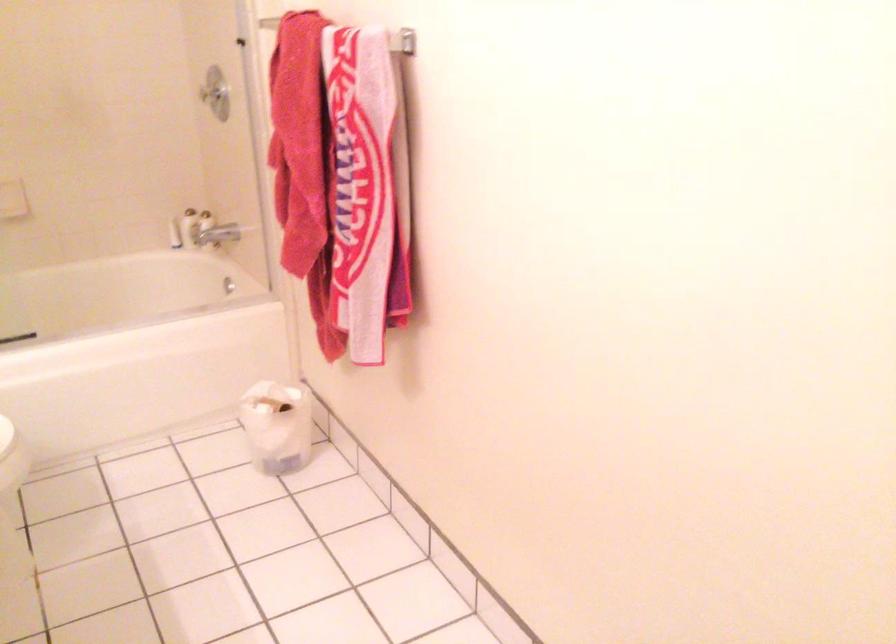
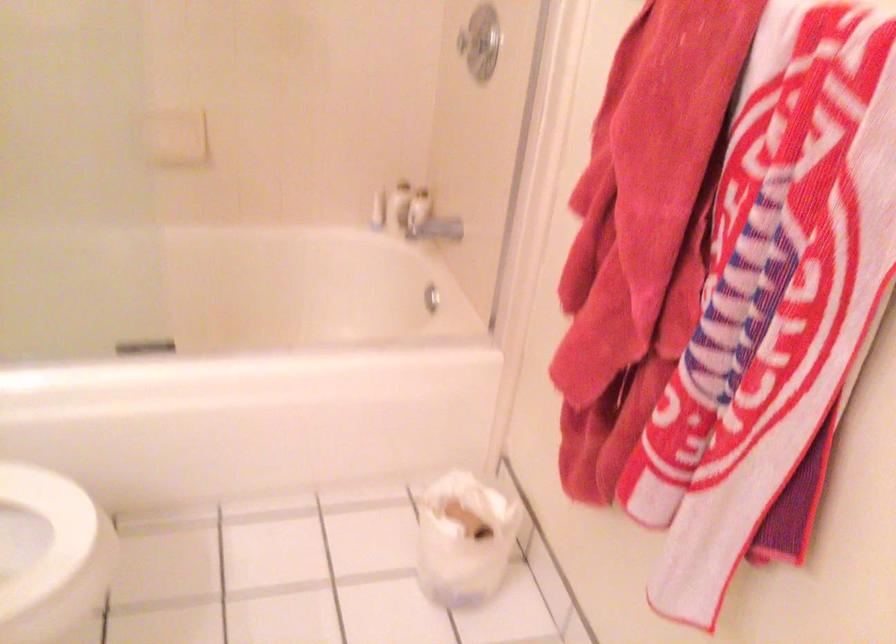
Which direction would the cameraman need to move to produce the second image?

The cameraman moved toward left, forward.